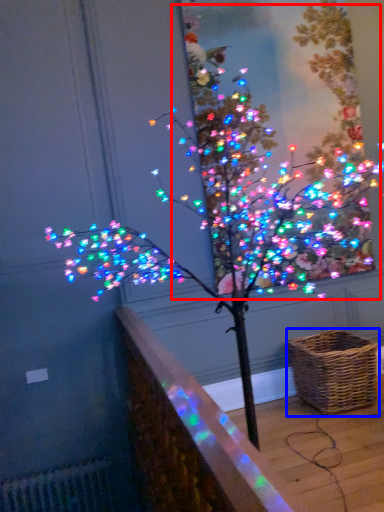
Question: Among these objects, which one is nearest to the camera, christmas tree (highlighted by a red box) or picnic basket (highlighted by a blue box)?

Choices:
 (A) christmas tree
 (B) picnic basket

Answer: (B)